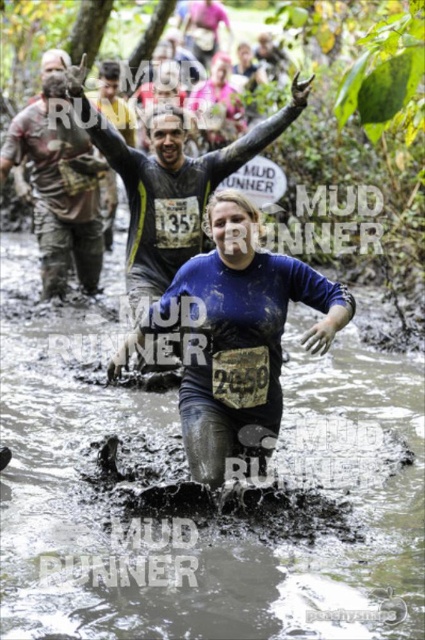
You are a photographer at the mud run event. You need to capture a photo of the blue fabric shirt at center and the blue matte shirt at center. Which one is positioned lower in the image?

The blue fabric shirt at center is located below the blue matte shirt at center, so it is positioned lower in the image.

You are a race organizer planning to place a safety cone at the point marked by the coordinates point (183,476). Based on the scene description, what obstacle is located at that point?

The point (183,476) corresponds to muddy water at center, so the safety cone should be placed at the muddy water at center obstacle.

You are a photographer positioned at the starting line of the mud run. You want to capture a photo that emphasizes the muddy water at center while ensuring the blue matte shirt at center is still visible but less prominent. Based on their positions, is this possible?

The muddy water at center is closer to the viewer than the blue matte shirt at center. By focusing on the muddy water at center, the blue matte shirt at center will naturally appear less prominent in the background, making it possible to achieve the desired composition.